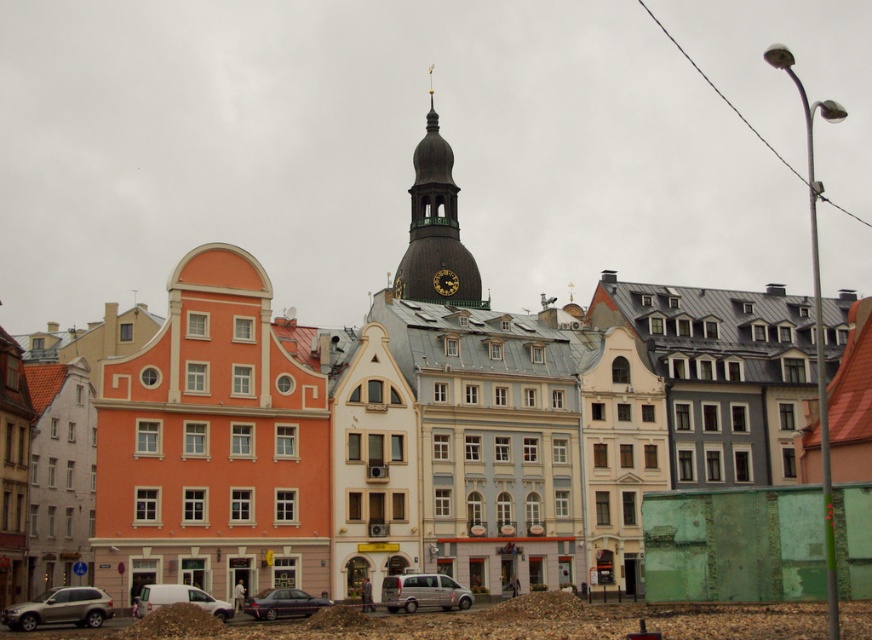
You are a tourist in the European town square and want to take a photo that includes both the silver metallic van at center and the metallic gray sedan at center. Which vehicle should you position closer to the camera to ensure both are fully visible in the frame?

To ensure both the silver metallic van at center and the metallic gray sedan at center are fully visible in the frame, position the silver metallic van at center closer to the camera since it is smaller than the metallic gray sedan at center. This adjustment will help balance their sizes in the photo.

You are standing in the town square and want to take a photo of the dark brown wood clock tower at center. Where should you position yourself to capture it in the frame?

You should position yourself at point (x=436, y=227) to capture the dark brown wood clock tower at center in the frame.